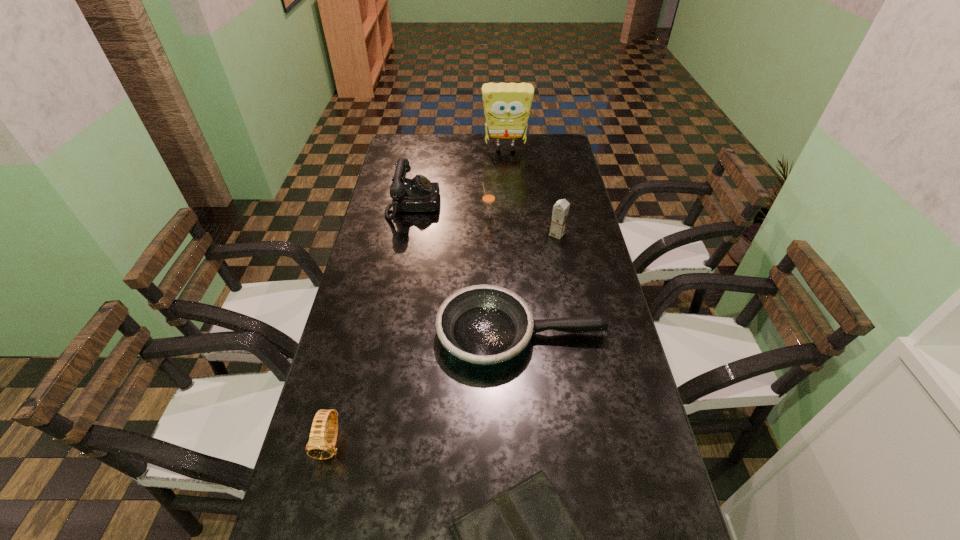
The image size is (960, 540). In the image, there is a desktop. Find the location of `vacant region at the far left corner`. vacant region at the far left corner is located at coordinates (419, 134).

I want to click on free spot at the far right corner of the desktop, so click(540, 146).

You are a GUI agent. You are given a task and a screenshot of the screen. Output one action in this format:
    pyautogui.click(x=<x>, y=<y>)
    Task: Click on the free space between the fifth farthest object and the farthest object
    
    Given the screenshot: What is the action you would take?
    pyautogui.click(x=514, y=242)

Where is `free space between the third nearest object and the sixth farthest object`? Image resolution: width=960 pixels, height=540 pixels. free space between the third nearest object and the sixth farthest object is located at coordinates (426, 388).

Identify the location of empty space that is in between the fourth nearest object and the fifth farthest object. The width and height of the screenshot is (960, 540). tap(540, 284).

The height and width of the screenshot is (540, 960). I want to click on vacant area between the sponge and the telephone, so click(x=459, y=177).

Locate an element on the screen. The height and width of the screenshot is (540, 960). vacant area that lies between the frying pan and the watch is located at coordinates (426, 388).

You are a GUI agent. You are given a task and a screenshot of the screen. Output one action in this format:
    pyautogui.click(x=<x>, y=<y>)
    Task: Click on the free space between the frying pan and the fourth farthest object
    Image resolution: width=960 pixels, height=540 pixels.
    Given the screenshot: What is the action you would take?
    pyautogui.click(x=540, y=284)

Identify the location of unoccupied position between the straw and the telephone. Image resolution: width=960 pixels, height=540 pixels. (450, 211).

Image resolution: width=960 pixels, height=540 pixels. I want to click on object that can be found as the fifth closest to the straw, so click(x=320, y=448).